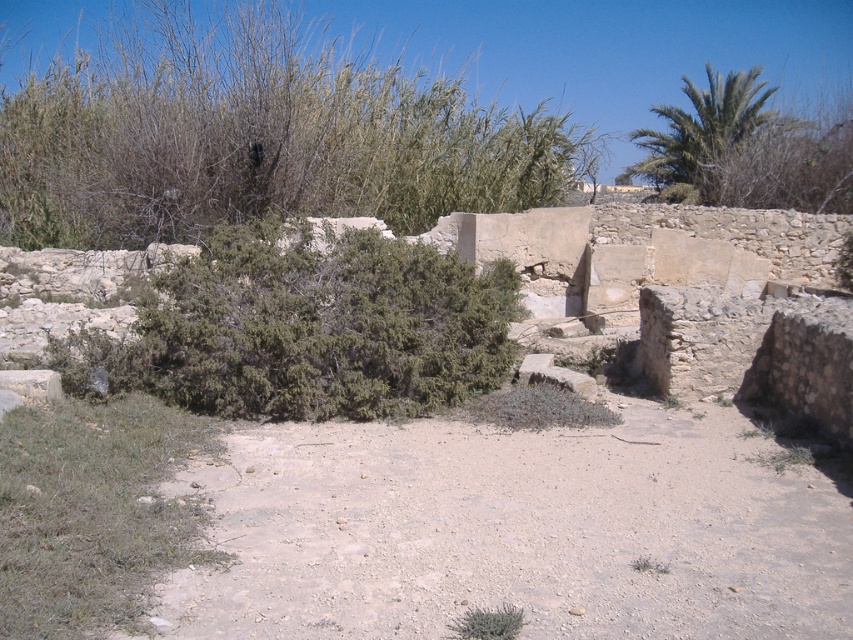
Question: Which point is farther from the camera taking this photo?

Choices:
 (A) (157, 99)
 (B) (370, 262)
 (C) (672, 184)

Answer: (C)

Question: Is green leafy bush at upper left behind green shrub at center?

Choices:
 (A) yes
 (B) no

Answer: (A)

Question: In this image, where is green leafy palm at upper right located relative to green leafy bush at lower center?

Choices:
 (A) right
 (B) left

Answer: (A)

Question: Which point is farther to the camera?

Choices:
 (A) (103, 118)
 (B) (496, 264)
 (C) (509, 628)

Answer: (A)

Question: Among these points, which one is nearest to the camera?

Choices:
 (A) (286, 45)
 (B) (508, 632)
 (C) (701, 170)
 (D) (363, 275)

Answer: (B)

Question: Where is green leafy bush at upper left located in relation to green leafy bush at lower center in the image?

Choices:
 (A) right
 (B) left

Answer: (B)